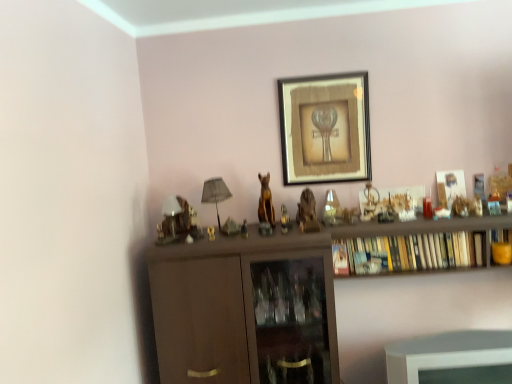
Question: From a real-world perspective, is matte brown statue at center, arranged as the third toy when viewed from the right, located beneath wooden bookshelf at center?

Choices:
 (A) no
 (B) yes

Answer: (A)

Question: Is matte brown statue at center, arranged as the second toy when viewed from the left, taller than wooden bookshelf at center?

Choices:
 (A) no
 (B) yes

Answer: (A)

Question: Considering the relative sizes of matte brown statue at center, arranged as the second toy when viewed from the left, and wooden bookshelf at center in the image provided, is matte brown statue at center, arranged as the second toy when viewed from the left, thinner than wooden bookshelf at center?

Choices:
 (A) no
 (B) yes

Answer: (B)

Question: From the image's perspective, is matte brown statue at center, arranged as the second toy when viewed from the left, on top of wooden bookshelf at center?

Choices:
 (A) no
 (B) yes

Answer: (B)

Question: Is wooden bookshelf at center a part of matte brown statue at center, arranged as the second toy when viewed from the left?

Choices:
 (A) no
 (B) yes

Answer: (A)

Question: Is gold metallic statue at center, which ranks as the second animal in right-to-left order, inside or outside of wooden bookshelf at center?

Choices:
 (A) inside
 (B) outside

Answer: (B)

Question: Does point (259, 213) appear closer or farther from the camera than point (373, 236)?

Choices:
 (A) farther
 (B) closer

Answer: (A)

Question: In terms of width, does gold metallic statue at center, which ranks as the second animal in right-to-left order, look wider or thinner when compared to wooden bookshelf at center?

Choices:
 (A) wide
 (B) thin

Answer: (B)

Question: Considering the relative positions of gold metallic statue at center, the first animal in the left-to-right sequence, and wooden bookshelf at center in the image provided, is gold metallic statue at center, the first animal in the left-to-right sequence, to the left or to the right of wooden bookshelf at center?

Choices:
 (A) right
 (B) left

Answer: (B)

Question: Is wooden statue at center, which is the second animal in left-to-right order, to the left or to the right of metallic gold statue at center, placed as the third toy when sorted from left to right, in the image?

Choices:
 (A) left
 (B) right

Answer: (B)

Question: From the image's perspective, is wooden statue at center, which is the second animal in left-to-right order, above or below metallic gold statue at center, placed as the third toy when sorted from left to right?

Choices:
 (A) below
 (B) above

Answer: (B)

Question: Does point (313, 211) appear closer or farther from the camera than point (287, 223)?

Choices:
 (A) closer
 (B) farther

Answer: (B)

Question: In terms of size, does wooden statue at center, acting as the first animal starting from the right, appear bigger or smaller than metallic gold statue at center, placed as the third toy when sorted from left to right?

Choices:
 (A) big
 (B) small

Answer: (A)

Question: Considering their positions, is metallic gold statue at center, placed as the third toy when sorted from left to right, located in front of or behind matte black lampshade at center?

Choices:
 (A) front
 (B) behind

Answer: (B)

Question: Looking at their shapes, would you say metallic gold statue at center, which is counted as the 2th toy, starting from the right, is wider or thinner than matte black lampshade at center?

Choices:
 (A) thin
 (B) wide

Answer: (A)